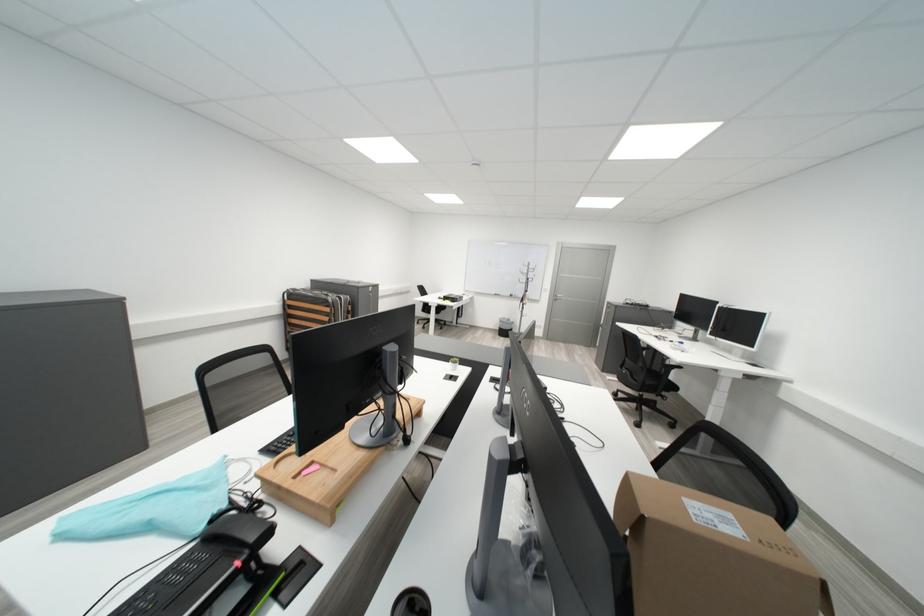
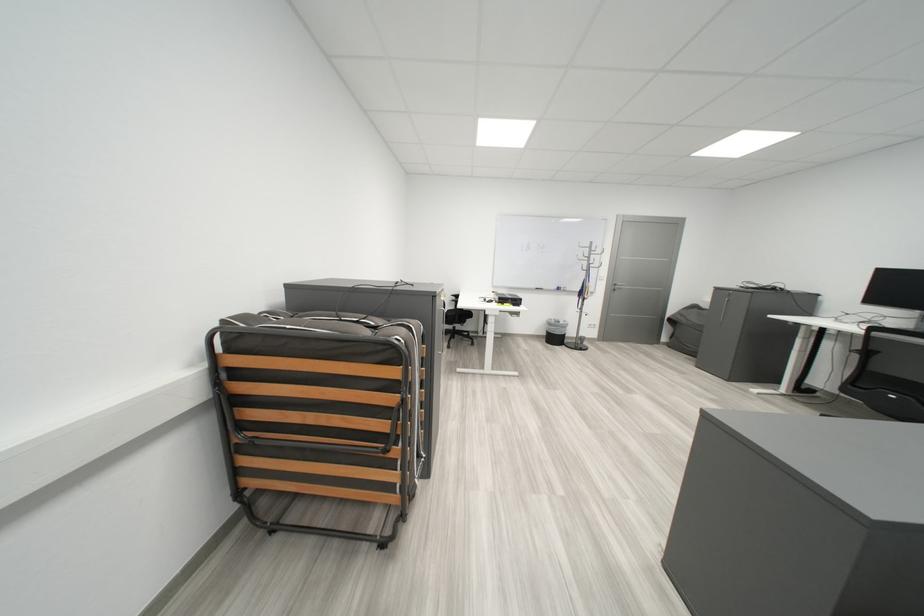
The point at (514, 323) is marked in the first image. Where is the corresponding point in the second image?

(563, 326)